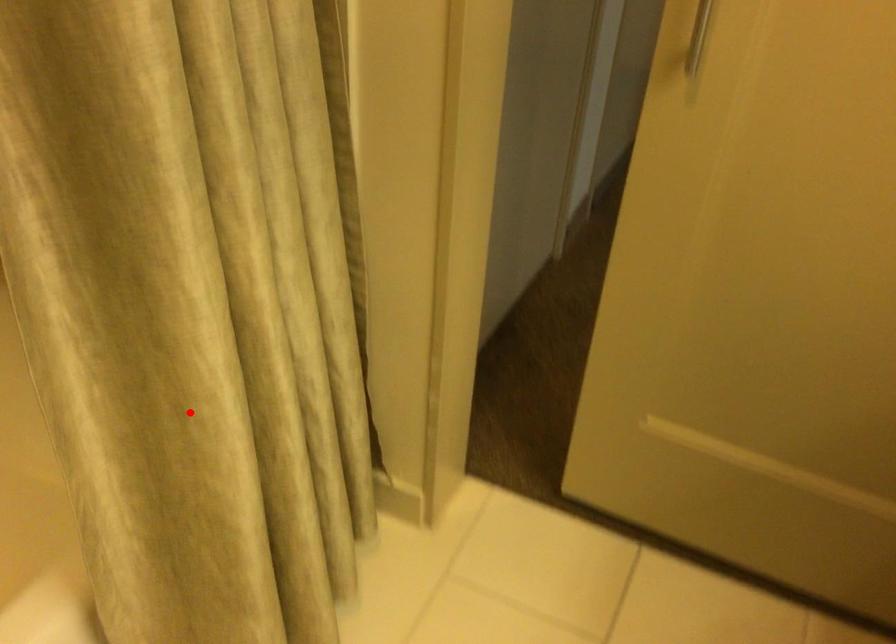
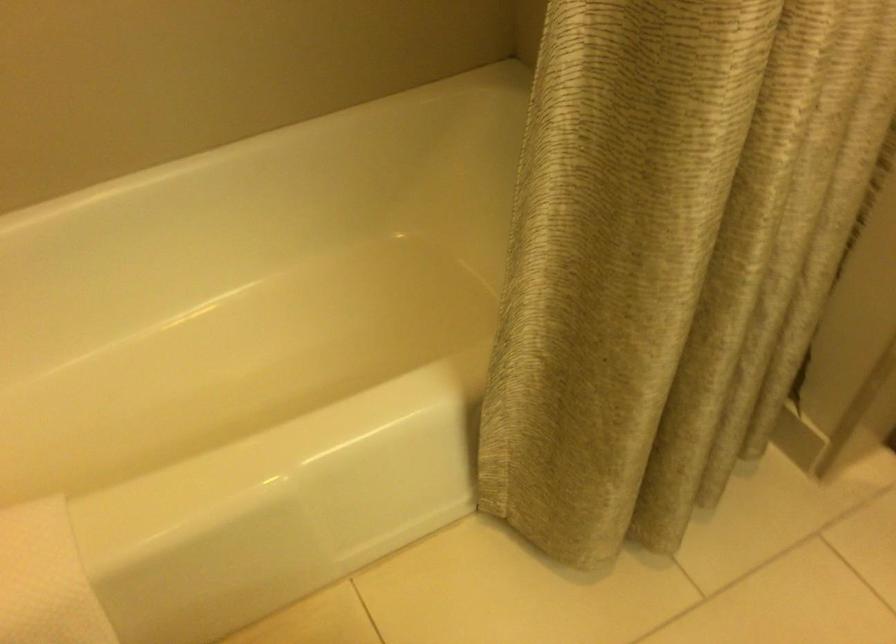
Question: I am providing you with two images of the same scene from different viewpoints. In image1, a red point is highlighted. Considering the same 3D point in image2, which of the following is correct?

Choices:
 (A) It is closer
 (B) It is farther

Answer: (A)